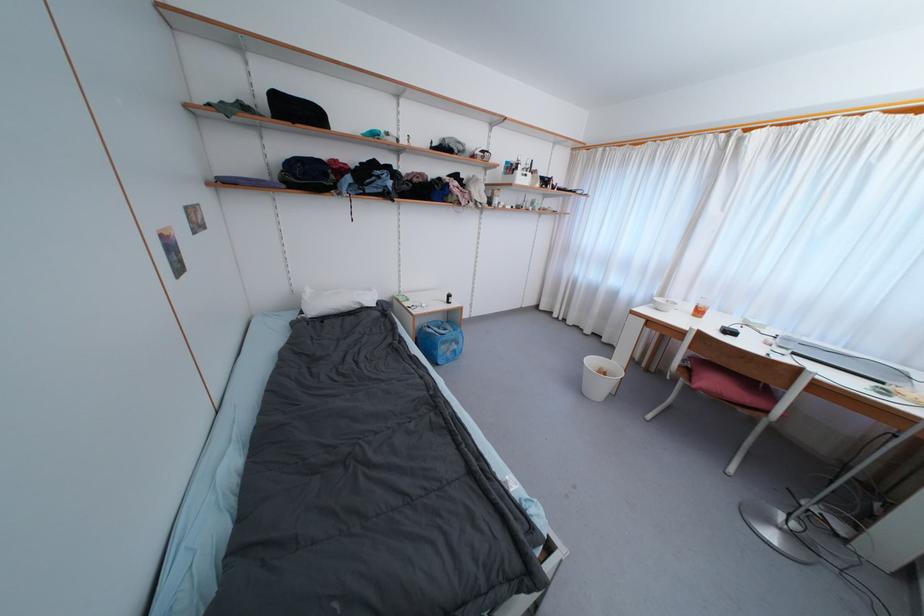
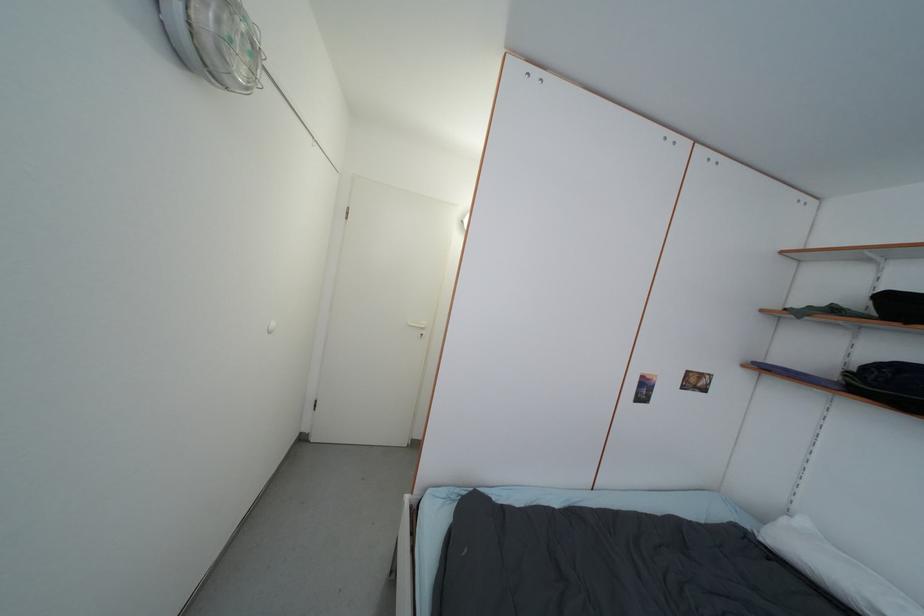
Question: The camera is either moving clockwise (left) or counter-clockwise (right) around the object. The first image is from the beginning of the video and the second image is from the end. Is the camera moving left or right when shooting the video?

Choices:
 (A) Left
 (B) Right

Answer: (B)